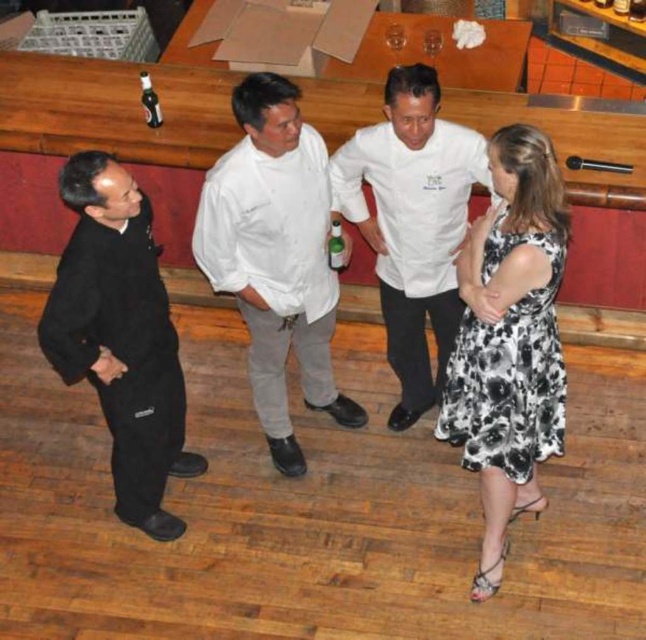
Does black matte suit at left have a smaller size compared to green glass bottle at center?

No, black matte suit at left is not smaller than green glass bottle at center.

Which of these two, black matte suit at left or green glass bottle at center, stands taller?

With more height is black matte suit at left.

You are a GUI agent. You are given a task and a screenshot of the screen. Output one action in this format:
    pyautogui.click(x=<x>, y=<y>)
    Task: Click on the black matte suit at left
    Image resolution: width=646 pixels, height=640 pixels.
    Given the screenshot: What is the action you would take?
    pyautogui.click(x=120, y=337)

The image size is (646, 640). In order to click on black matte suit at left in this screenshot , I will do `click(120, 337)`.

Who is taller, white cotton chef coat at center or clear glass bottle at upper center?

white cotton chef coat at center

Does white cotton chef coat at center have a lesser width compared to clear glass bottle at upper center?

Incorrect, white cotton chef coat at center's width is not less than clear glass bottle at upper center's.

Does point (249, 300) come farther from viewer compared to point (640, 20)?

That is False.

Where is `white cotton chef coat at center`? The width and height of the screenshot is (646, 640). white cotton chef coat at center is located at coordinates (275, 256).

Consider the image. Is white chef coat at center thinner than clear glass bottle at upper left?

Incorrect, white chef coat at center's width is not less than clear glass bottle at upper left's.

Which is above, white chef coat at center or clear glass bottle at upper left?

Positioned higher is clear glass bottle at upper left.

This screenshot has width=646, height=640. Identify the location of white chef coat at center. (412, 224).

The width and height of the screenshot is (646, 640). I want to click on white chef coat at center, so click(412, 224).